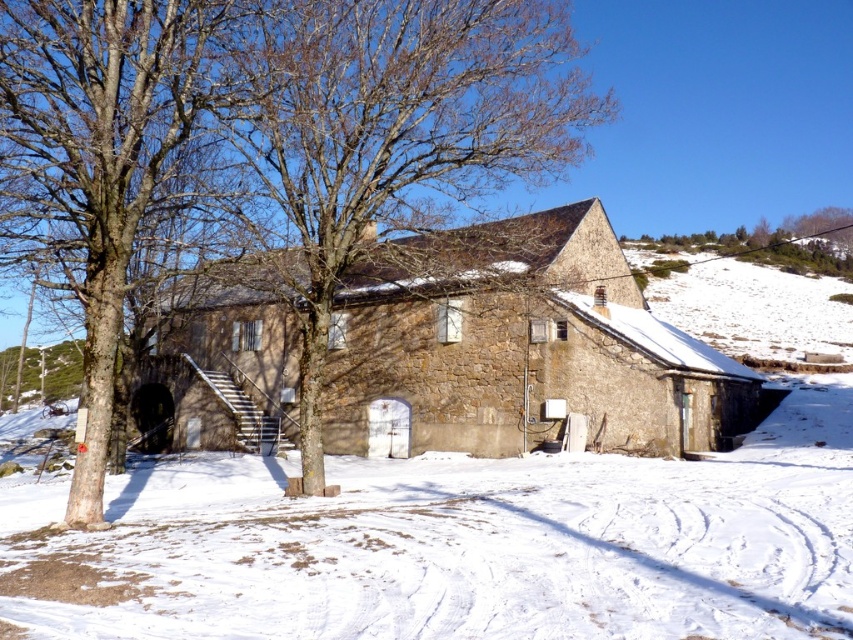
Question: Does brown bark tree at center have a smaller size compared to green leafy tree at upper right?

Choices:
 (A) yes
 (B) no

Answer: (A)

Question: Which point appears closest to the camera in this image?

Choices:
 (A) (51, 92)
 (B) (410, 67)

Answer: (A)

Question: Which of these objects is positioned closest to the brown bark tree at center?

Choices:
 (A) brown bark tree at left
 (B) green leafy tree at upper right

Answer: (A)

Question: Among these objects, which one is farthest from the camera?

Choices:
 (A) brown bark tree at left
 (B) brown bark tree at center

Answer: (B)

Question: Is brown bark tree at center smaller than green leafy tree at upper right?

Choices:
 (A) yes
 (B) no

Answer: (A)

Question: Is brown bark tree at left thinner than green leafy tree at upper right?

Choices:
 (A) no
 (B) yes

Answer: (B)